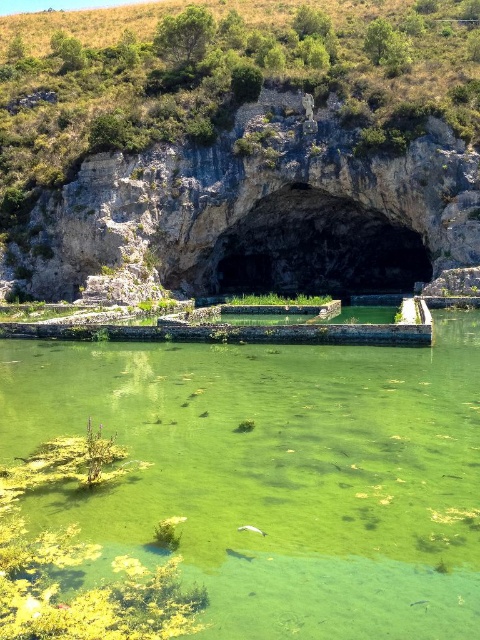
Question: Is rocky cliff at center further to the viewer compared to black stone cave at center?

Choices:
 (A) no
 (B) yes

Answer: (A)

Question: Which object is the farthest from the rocky cliff at center?

Choices:
 (A) green algae pond at center
 (B) black stone cave at center

Answer: (A)

Question: In this image, where is rocky cliff at center located relative to black stone cave at center?

Choices:
 (A) right
 (B) left

Answer: (B)

Question: Is rocky cliff at center to the left of black stone cave at center from the viewer's perspective?

Choices:
 (A) yes
 (B) no

Answer: (A)

Question: Among these objects, which one is farthest from the camera?

Choices:
 (A) green algae pond at center
 (B) black stone cave at center

Answer: (B)

Question: Which point is farther from the camera taking this photo?

Choices:
 (A) (23, 230)
 (B) (255, 582)

Answer: (A)